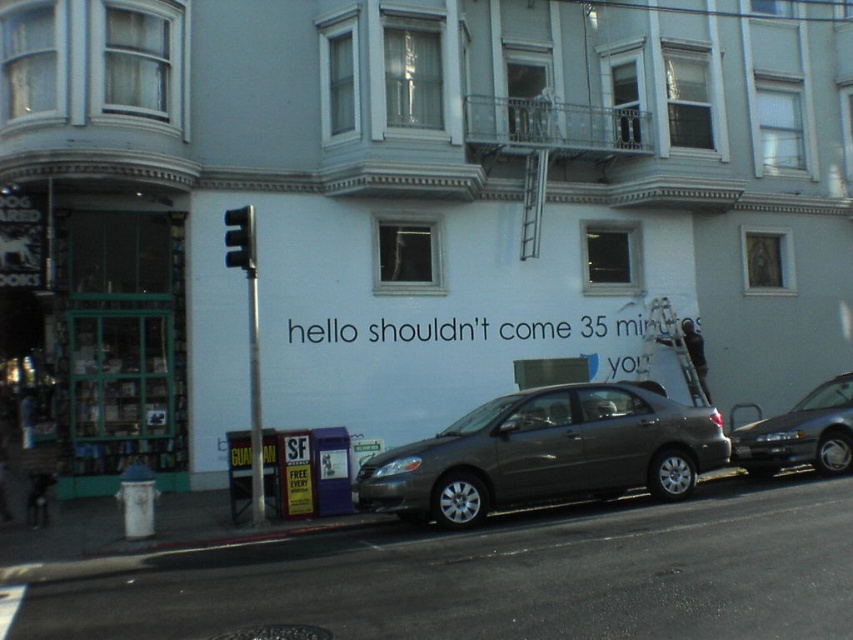
You are driving a car and see the satin gray sedan at center and the black plastic traffic light at upper left. Which object is positioned to the right of the other?

The satin gray sedan at center is to the right of the black plastic traffic light at upper left.

Consider the image. You are standing at the newspaper stand with a yellow sign that reads FREE EVERY. You see two points marked on the ground in front of the building. The first point is at coordinate point (491,442) and the second point is at coordinate point (790,433). Which point is closer to you?

Point (491,442) is in front of point (790,433), so the first point is closer to you.